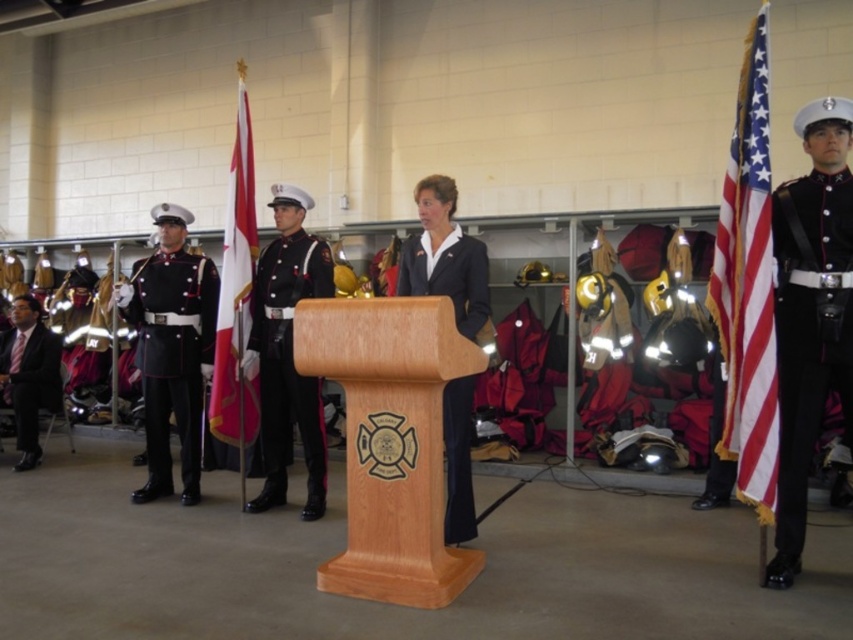
Question: Which object appears farthest from the camera in this image?

Choices:
 (A) black glossy uniform at center
 (B) american flag at right
 (C) navy blue fabric uniform at center
 (D) shiny black uniform at left

Answer: (D)

Question: Can you confirm if black glossy uniform at right is positioned above red fabric flag at center?

Choices:
 (A) yes
 (B) no

Answer: (B)

Question: Based on their relative distances, which object is farther from the red fabric flag at center?

Choices:
 (A) shiny black uniform at left
 (B) black smooth suit at left
 (C) black glossy uniform at right

Answer: (C)

Question: Among these points, which one is nearest to the camera?

Choices:
 (A) (9, 368)
 (B) (177, 378)
 (C) (247, 161)
 (D) (804, 337)

Answer: (D)

Question: Can you confirm if american flag at right is wider than red fabric flag at center?

Choices:
 (A) no
 (B) yes

Answer: (A)

Question: Is american flag at right further to camera compared to black glossy uniform at center?

Choices:
 (A) yes
 (B) no

Answer: (B)